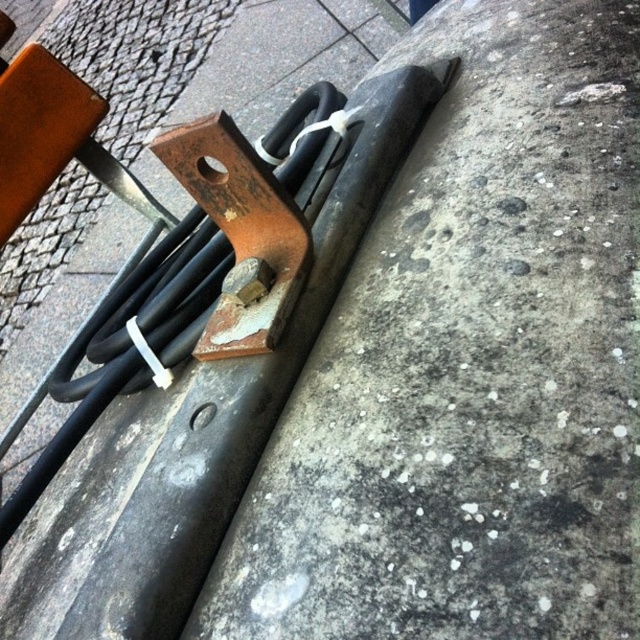
Question: Does gray concrete at center lie in front of rusty metal curb at center?

Choices:
 (A) yes
 (B) no

Answer: (A)

Question: Which point is farther to the camera?

Choices:
 (A) (252, 628)
 (B) (160, 621)

Answer: (B)

Question: Is gray concrete at center closer to camera compared to rusty metal curb at center?

Choices:
 (A) no
 (B) yes

Answer: (B)

Question: Is the position of gray concrete at center less distant than that of rusty metal curb at center?

Choices:
 (A) no
 (B) yes

Answer: (B)

Question: Which point is closer to the camera taking this photo?

Choices:
 (A) (170, 611)
 (B) (468, 419)

Answer: (B)

Question: Which point is closer to the camera?

Choices:
 (A) rusty metal curb at center
 (B) gray concrete at center

Answer: (B)